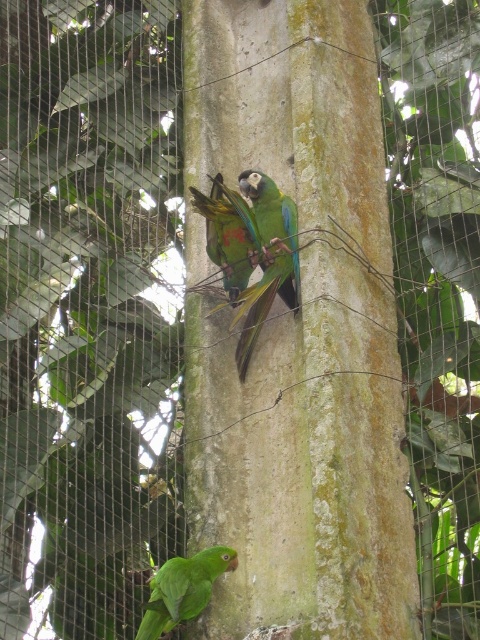
Question: Which of the following is the closest to the observer?

Choices:
 (A) green matte parrot at lower left
 (B) multicolored feathers parrot at center

Answer: (A)

Question: Is green matte parrot at lower left to the left of multicolored feathers parrot at center from the viewer's perspective?

Choices:
 (A) no
 (B) yes

Answer: (B)

Question: Does green matte parrot at lower left appear under multicolored feathers parrot at center?

Choices:
 (A) yes
 (B) no

Answer: (A)

Question: Does green matte parrot at lower left have a greater width compared to multicolored feathers parrot at center?

Choices:
 (A) yes
 (B) no

Answer: (A)

Question: Estimate the real-world distances between objects in this image. Which object is closer to the green matte parrot at lower left?

Choices:
 (A) multicolored feathers parrot at center
 (B) blue-green feathers parrot at center

Answer: (B)

Question: Estimate the real-world distances between objects in this image. Which object is farther from the blue-green feathers parrot at center?

Choices:
 (A) green matte parrot at lower left
 (B) multicolored feathers parrot at center

Answer: (A)